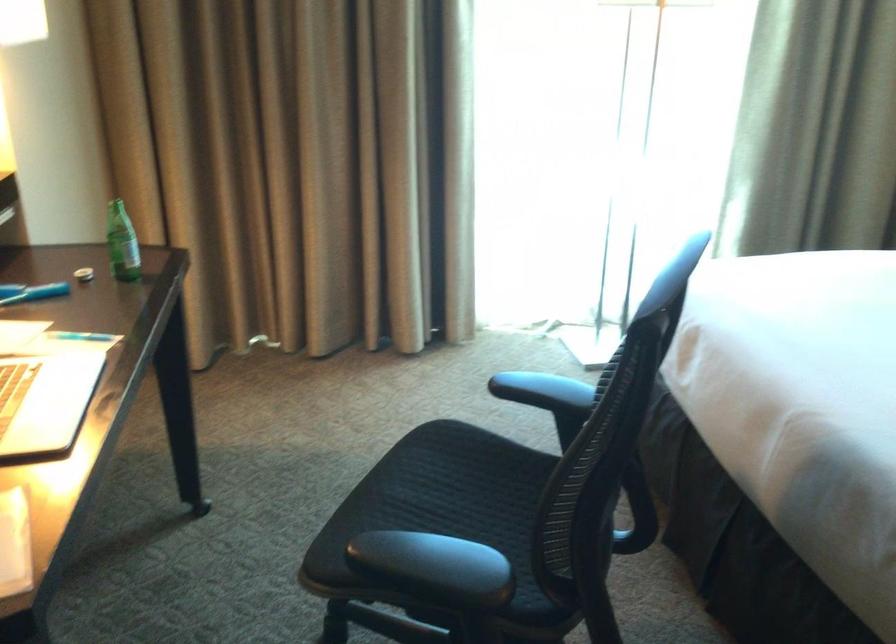
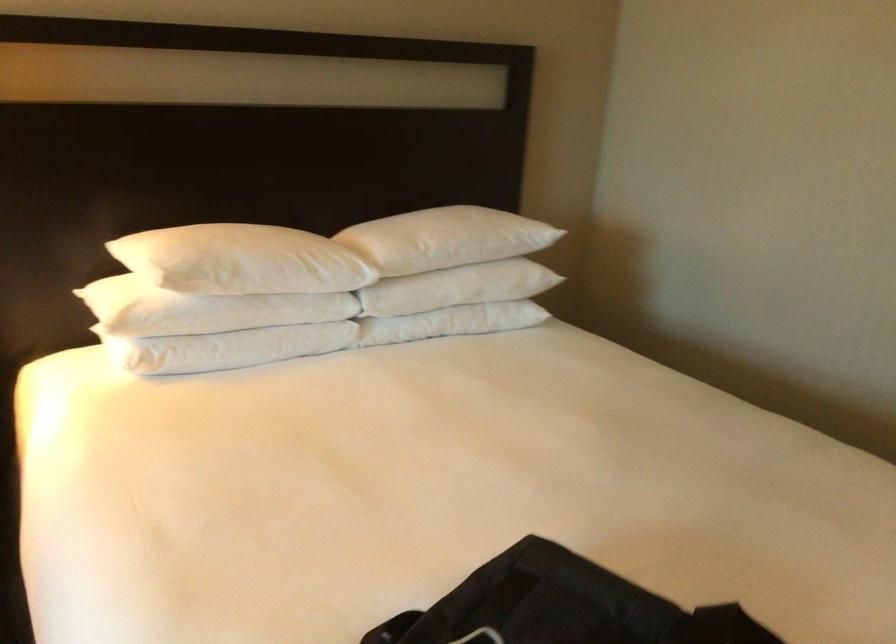
The images are taken continuously from a first-person perspective. In which direction is your viewpoint rotating?

The rotation direction of the camera is right-down.